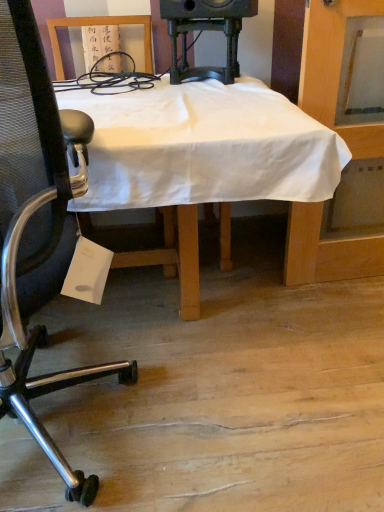
Question: Relative to white cloth-covered desk at center, is metallic mesh chair at left in front or behind?

Choices:
 (A) behind
 (B) front

Answer: (B)

Question: Considering the positions of metallic mesh chair at left and white cloth-covered desk at center in the image, is metallic mesh chair at left bigger or smaller than white cloth-covered desk at center?

Choices:
 (A) big
 (B) small

Answer: (B)

Question: Estimate the real-world distances between objects in this image. Which object is closer to the metallic mesh chair at left?

Choices:
 (A) black plastic speaker at upper center
 (B) white cloth-covered desk at center

Answer: (B)

Question: Which object is positioned farthest from the black plastic speaker at upper center?

Choices:
 (A) white cloth-covered desk at center
 (B) metallic mesh chair at left

Answer: (B)